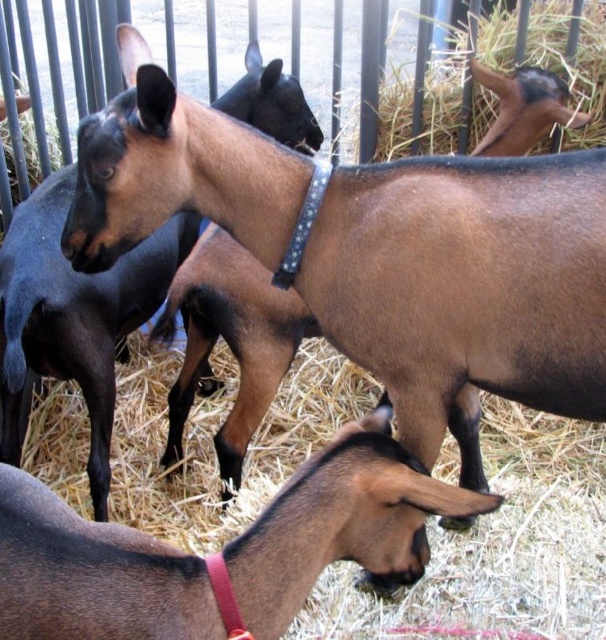
Is point (310, 273) closer to camera compared to point (501, 106)?

Yes.

Is the position of brown matte goat at center less distant than that of brown matte goat at upper right?

Yes, brown matte goat at center is in front of brown matte goat at upper right.

I want to click on brown matte goat at center, so click(x=376, y=252).

Locate an element on the screen. brown matte goat at center is located at coordinates (376, 252).

Which is in front, point (216, 637) or point (24, 364)?

Point (216, 637) is more forward.

The height and width of the screenshot is (640, 606). Identify the location of brown matte goat at lower left. (221, 550).

Find the location of `brown matte goat at lower left`. brown matte goat at lower left is located at coordinates (221, 550).

Is point (391, 275) positioned after point (335, 483)?

That is True.

Does brown matte goat at center lie behind brown matte goat at lower left?

That is True.

Image resolution: width=606 pixels, height=640 pixels. What are the coordinates of `brown matte goat at center` in the screenshot? It's located at (376, 252).